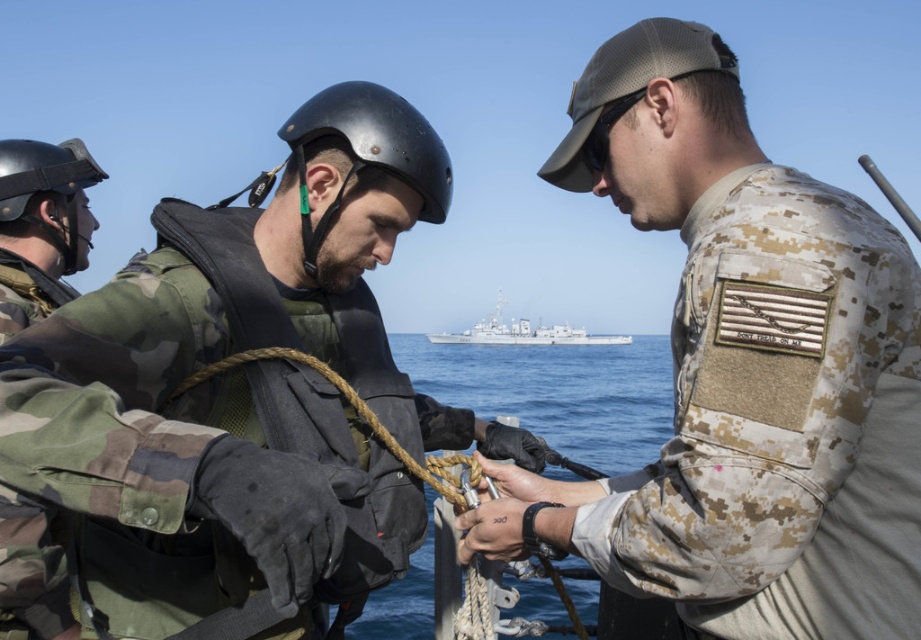
Question: Does camouflage fabric uniform at center have a lesser width compared to rope at center?

Choices:
 (A) no
 (B) yes

Answer: (B)

Question: Which point appears closest to the camera in this image?

Choices:
 (A) (780, 488)
 (B) (488, 364)
 (C) (10, 145)

Answer: (A)

Question: Which object is the farthest from the black rubber goggles at center?

Choices:
 (A) camouflage fabric uniform at center
 (B) black matte helmet at center
 (C) camouflage fabric jacket at center

Answer: (C)

Question: Does camouflage fabric jacket at center appear over white matte ship at center?

Choices:
 (A) no
 (B) yes

Answer: (A)

Question: Which point is closer to the camera taking this photo?

Choices:
 (A) (591, 152)
 (B) (811, 536)
 (C) (97, 170)
 (D) (525, 333)

Answer: (B)

Question: Is camouflage fabric jacket at center smaller than camouflage fabric uniform at center?

Choices:
 (A) yes
 (B) no

Answer: (B)